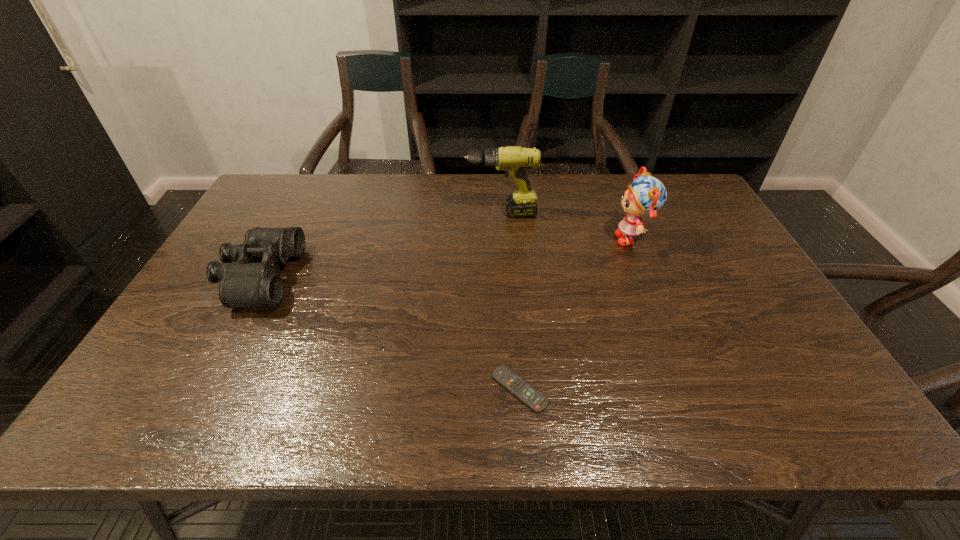
You are a GUI agent. You are given a task and a screenshot of the screen. Output one action in this format:
    pyautogui.click(x=<x>, y=<y>)
    Task: Click on the vacant space that satisfies the following two spatial constraints: 1. on the face of the doll; 2. on the front side of the remote control
    Image resolution: width=960 pixels, height=540 pixels.
    Given the screenshot: What is the action you would take?
    pyautogui.click(x=694, y=390)

Identify the location of free space that satisfies the following two spatial constraints: 1. at the eyepieces of the third tallest object; 2. on the back side of the shortest object. (200, 390).